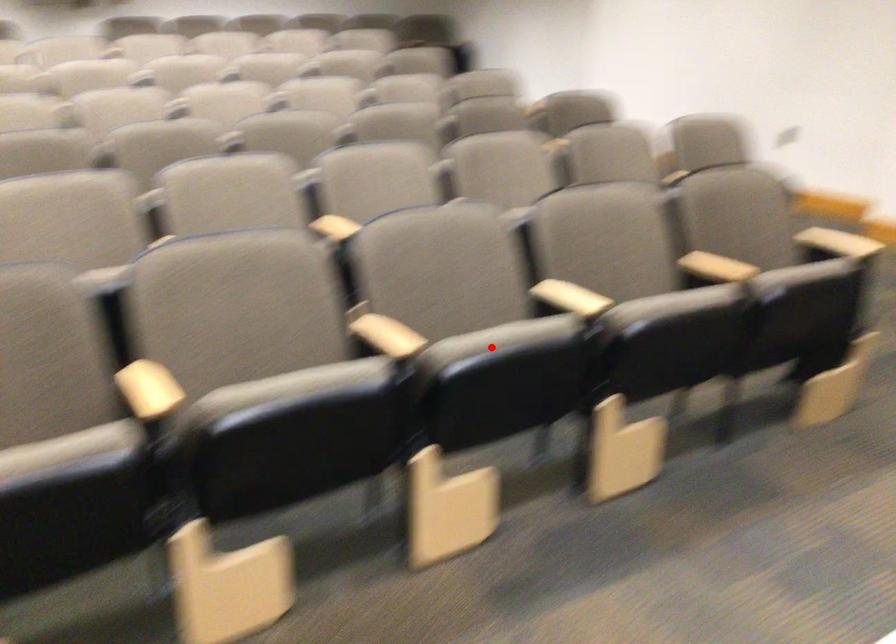
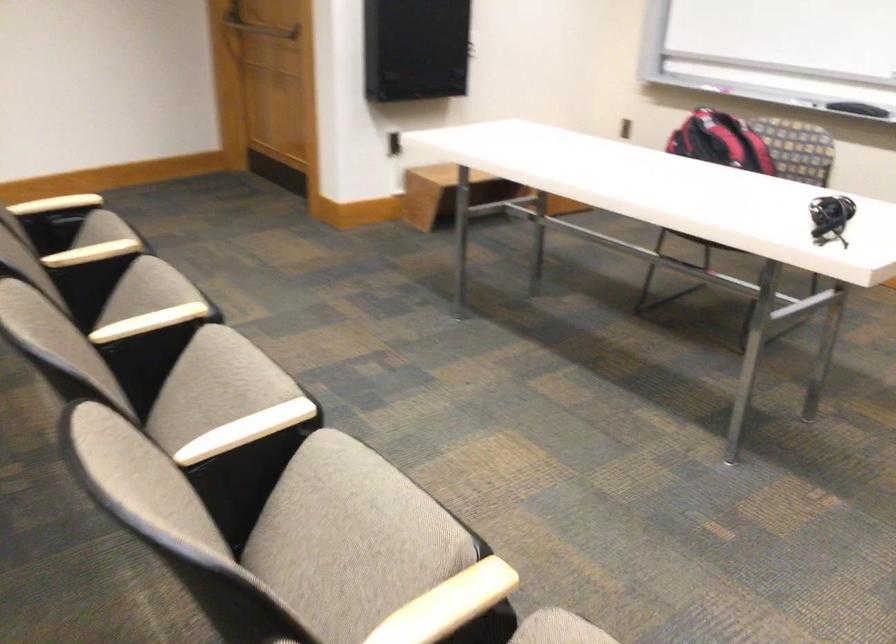
Question: I am providing you with two images of the same scene from different viewpoints. Given a red point in image1, look at the same physical point in image2. Is it:

Choices:
 (A) Closer to the viewpoint
 (B) Farther from the viewpoint

Answer: (A)